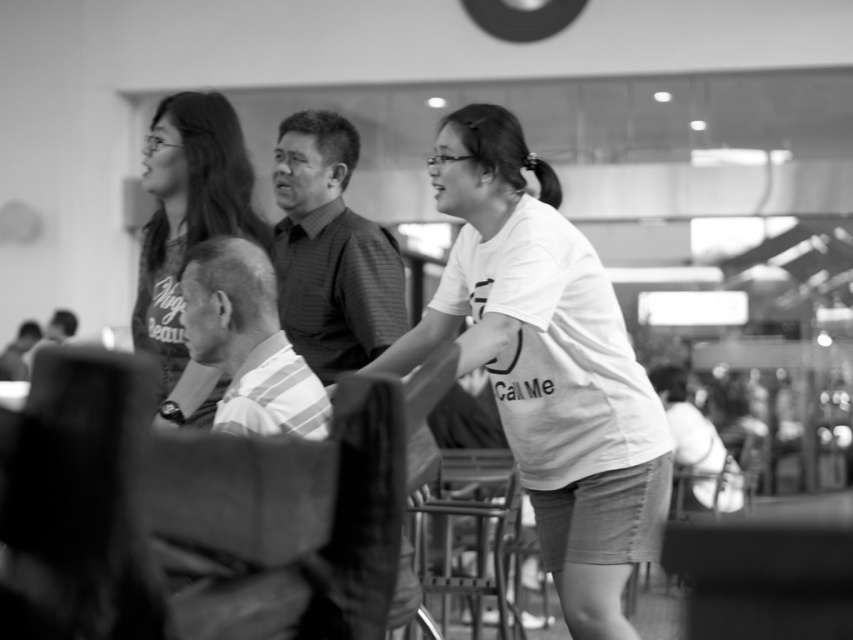
You are standing at a point in a public indoor space. You want to reach the point marked as point [158,129]. If your walking speed is 1.2 meters per second, how many seconds will it take you to reach there?

The distance between point [158,129] and the viewer is 4.27 meters. At a speed of 1.2 meters per second, it would take approximately 3.56 seconds to reach the point. Since the question asks for seconds, we can round to the nearest whole number, so about 4 seconds.

You are standing in the scene and want to take a photo of both point (518, 403) and point (165, 109). Which point should you focus on first to ensure both are in sharp focus?

You should focus on point (518, 403) first because it is closer to the camera than point (165, 109), ensuring both will be in focus when using depth of field.

In the black and white photo, there are two people wearing a white cotton shirt at center and a matte black shirt at upper left. Which one is positioned more to the right?

The white cotton shirt at center is positioned to the right of the matte black shirt at upper left.